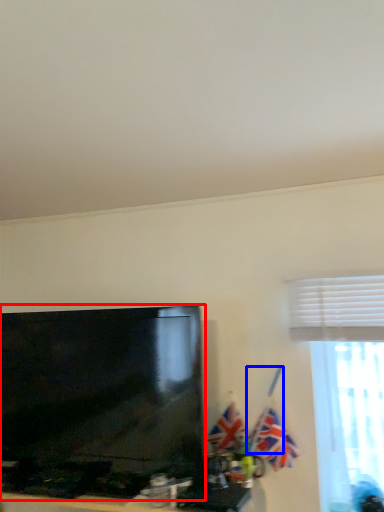
Question: Which object is closer to the camera taking this photo, television (highlighted by a red box) or flag pole (highlighted by a blue box)?

Choices:
 (A) television
 (B) flag pole

Answer: (A)